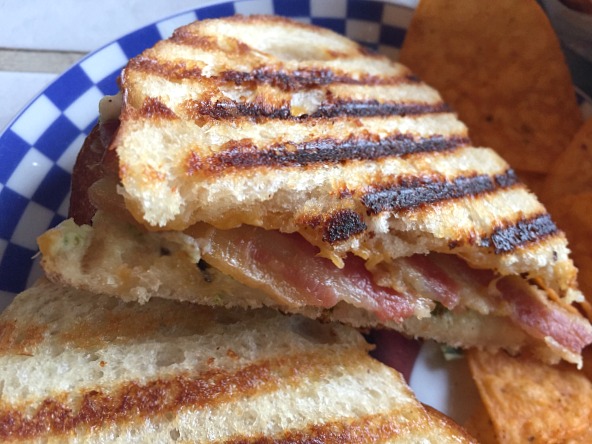
Locate an element on the screen. white surface is located at coordinates (56, 19), (15, 93).